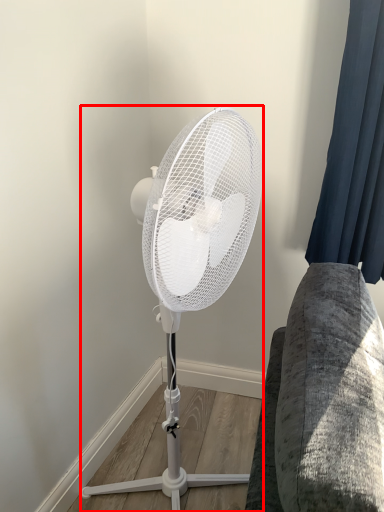
Question: In this image, where is mechanical fan (annotated by the red box) located relative to curtain?

Choices:
 (A) right
 (B) left

Answer: (B)